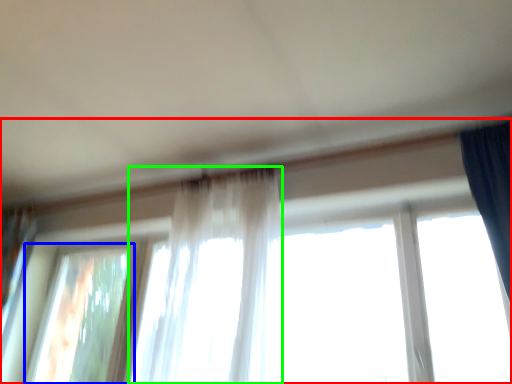
Question: Which object is positioned closest to window (highlighted by a red box)? Select from window (highlighted by a blue box) and curtain (highlighted by a green box).

Choices:
 (A) window
 (B) curtain

Answer: (A)